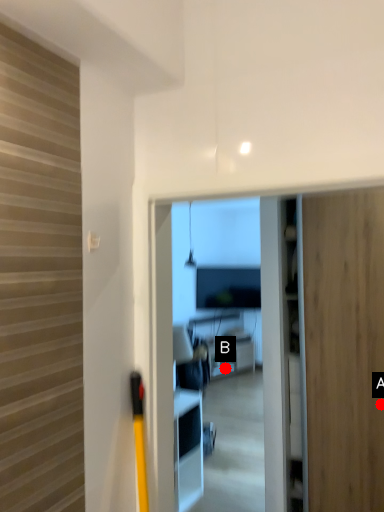
Question: Two points are circled on the image, labeled by A and B beside each circle. Which of the following is the closest to the observer?

Choices:
 (A) A is closer
 (B) B is closer

Answer: (A)